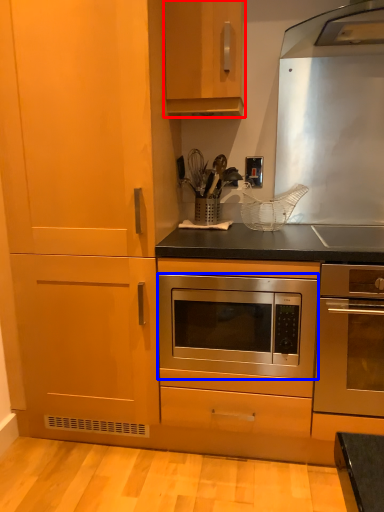
Question: Among these objects, which one is nearest to the camera, cabinetry (highlighted by a red box) or oven (highlighted by a blue box)?

Choices:
 (A) cabinetry
 (B) oven

Answer: (B)